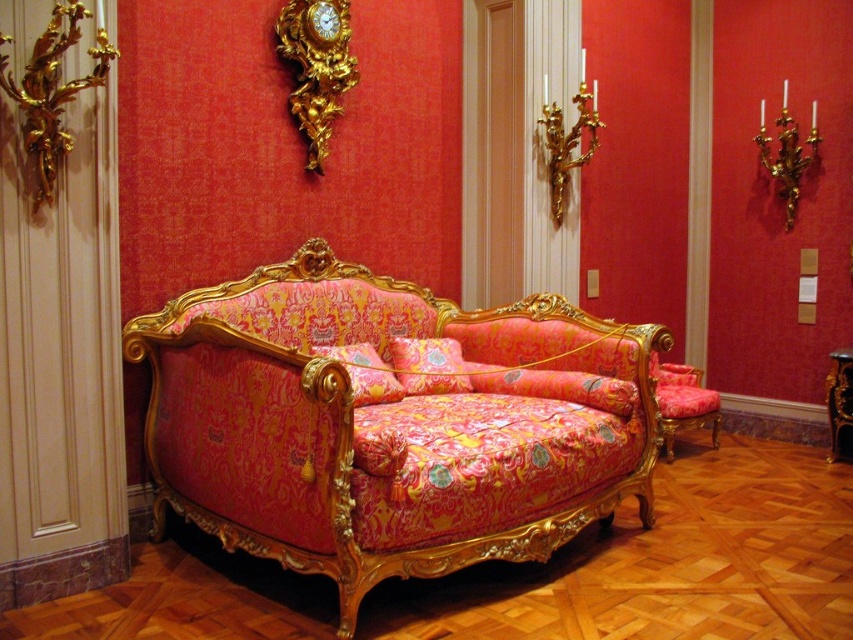
Question: Is gold ornate clock at upper center wider than velvet floral armchair at center?

Choices:
 (A) no
 (B) yes

Answer: (A)

Question: Is matte pink fabric couch at center bigger than velvet floral armchair at center?

Choices:
 (A) no
 (B) yes

Answer: (B)

Question: Estimate the real-world distances between objects in this image. Which object is farther from the velvet floral armchair at center?

Choices:
 (A) matte pink fabric couch at center
 (B) gold ornate clock at upper center

Answer: (B)

Question: Which object appears closest to the camera in this image?

Choices:
 (A) gold ornate clock at upper center
 (B) velvet floral armchair at center

Answer: (A)

Question: Among these points, which one is farthest from the camera?

Choices:
 (A) (688, 381)
 (B) (332, 45)
 (C) (306, 486)

Answer: (A)

Question: Is matte pink fabric couch at center below gold ornate clock at upper center?

Choices:
 (A) no
 (B) yes

Answer: (B)